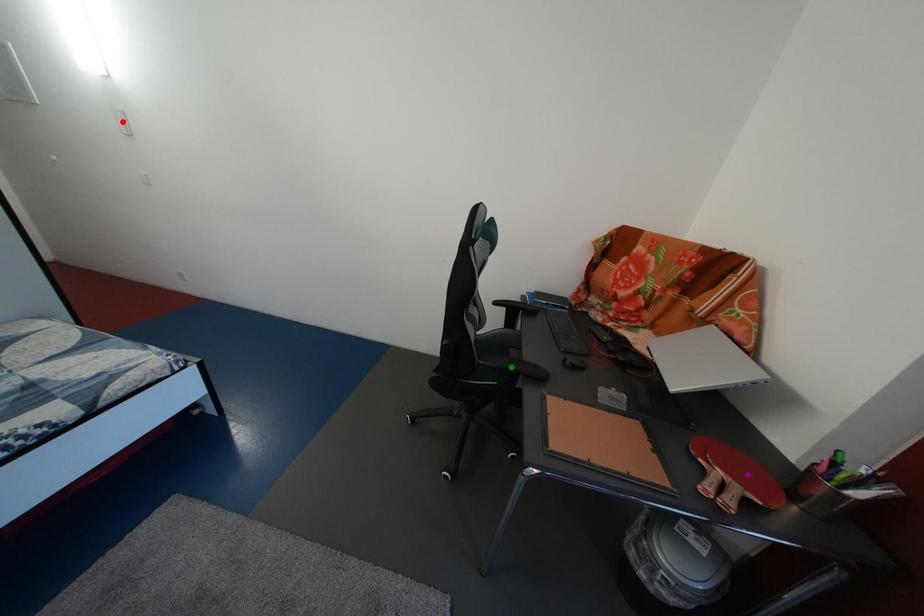
Order these from nearest to farthest:
green point, purple point, red point

purple point → green point → red point